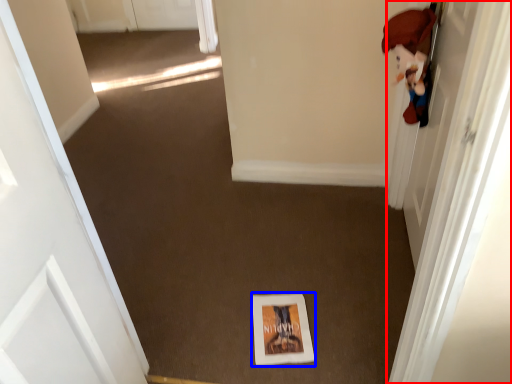
Question: Which object is closer to the camera taking this photo, door (highlighted by a red box) or print (highlighted by a blue box)?

Choices:
 (A) door
 (B) print

Answer: (A)